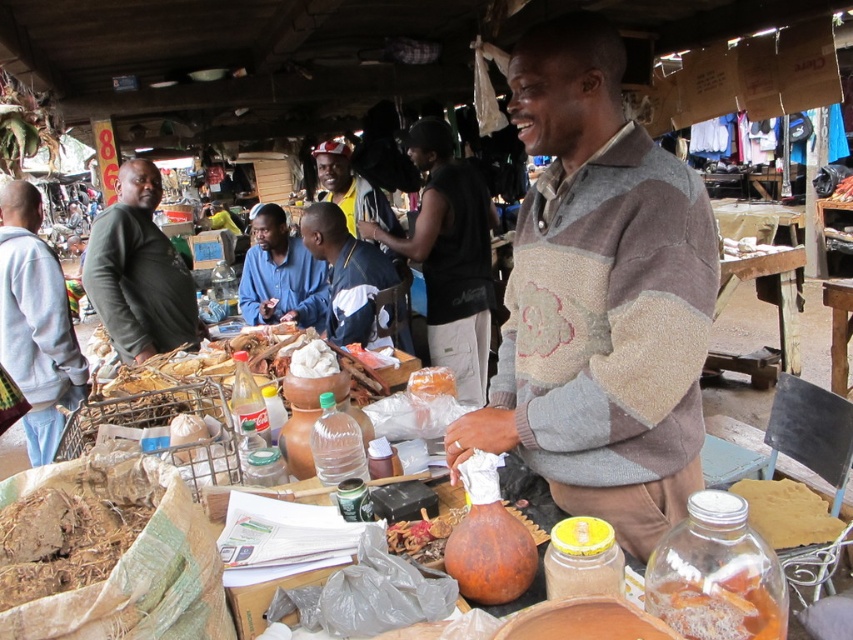
Which is below, blue cotton shirt at center or shiny metallic skewers at center?

blue cotton shirt at center

Which is behind, point (288, 298) or point (836, 198)?

Point (836, 198)

The height and width of the screenshot is (640, 853). In order to click on blue cotton shirt at center in this screenshot , I will do `click(280, 275)`.

Is patchwork sweater at center bigger than dark green sweater at left?

No, patchwork sweater at center is not bigger than dark green sweater at left.

Between patchwork sweater at center and dark green sweater at left, which one has less height?

dark green sweater at left is shorter.

Which is behind, point (614, 67) or point (108, 310)?

Positioned behind is point (108, 310).

The image size is (853, 640). Find the location of `patchwork sweater at center`. patchwork sweater at center is located at coordinates (599, 298).

Is patchwork sweater at center positioned before shiny metallic skewers at center?

Yes, it is in front of shiny metallic skewers at center.

You are a GUI agent. You are given a task and a screenshot of the screen. Output one action in this format:
    pyautogui.click(x=<x>, y=<y>)
    Task: Click on the patchwork sweater at center
    This screenshot has width=853, height=640.
    Given the screenshot: What is the action you would take?
    pyautogui.click(x=599, y=298)